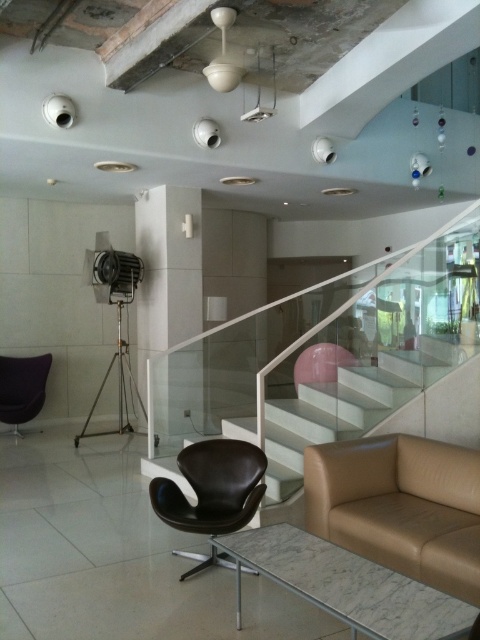
You are standing at the entrance of the lobby and see two points marked in the image. The first point is at coordinate point (170, 273) and the second point is at coordinate point (50, 360). Which point is closer to you as you face the lobby?

Point (170, 273) is in front of point (50, 360), so it is closer to you as you face the lobby.

You are a guest entering the lobby and want to sit down. You see the black leather chair at center and the velvet black chair at left. Which one is shorter and more suitable for someone of average height?

The black leather chair at center is shorter than the velvet black chair at left, making it more suitable for someone of average height.

You are standing in the lobby and want to move from the velvet black chair at left to the white glossy pillar at center. Which direction should you move to get closer to the pillar?

The white glossy pillar at center is closer to the viewer than the velvet black chair at left, so you should move forward towards the center of the room to get closer to the pillar.